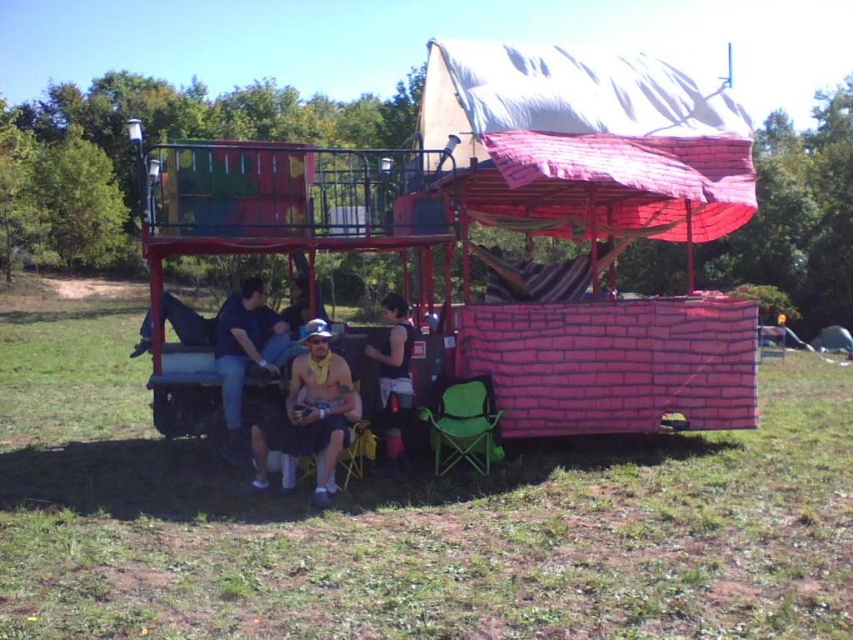
Can you confirm if naked skin at center is positioned to the right of black fabric bag at center?

Indeed, naked skin at center is positioned on the right side of black fabric bag at center.

Between naked skin at center and black fabric bag at center, which one has less height?

Standing shorter between the two is naked skin at center.

Is point (328, 356) positioned behind point (387, 304)?

No, (328, 356) is closer to viewer.

Where is `naked skin at center`? This screenshot has height=640, width=853. naked skin at center is located at coordinates (309, 417).

From the picture: Can you confirm if naked skin at center is bigger than dark blue jeans at lower center?

Actually, naked skin at center might be smaller than dark blue jeans at lower center.

Who is taller, naked skin at center or dark blue jeans at lower center?

naked skin at center is taller.

Between point (300, 435) and point (229, 396), which one is positioned behind?

The point (229, 396) is behind.

I want to click on naked skin at center, so click(x=309, y=417).

How distant is green fabric chair at lower center from black fabric bag at center?

A distance of 53.46 centimeters exists between green fabric chair at lower center and black fabric bag at center.

Can you confirm if green fabric chair at lower center is positioned below black fabric bag at center?

Yes.

Is point (440, 422) closer to camera compared to point (405, 372)?

Yes.

Where is `green fabric chair at lower center`? The height and width of the screenshot is (640, 853). green fabric chair at lower center is located at coordinates (463, 426).